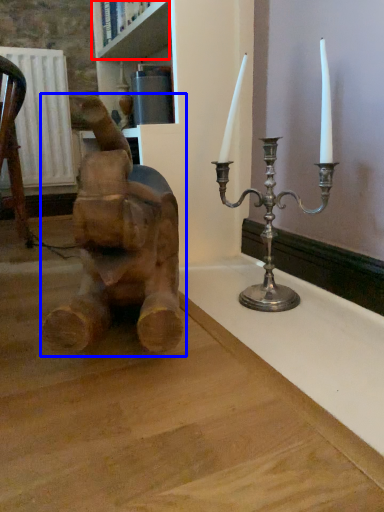
Question: Which object appears closest to the camera in this image, shelf (highlighted by a red box) or statue (sculpture) (highlighted by a blue box)?

Choices:
 (A) shelf
 (B) statue (sculpture)

Answer: (B)